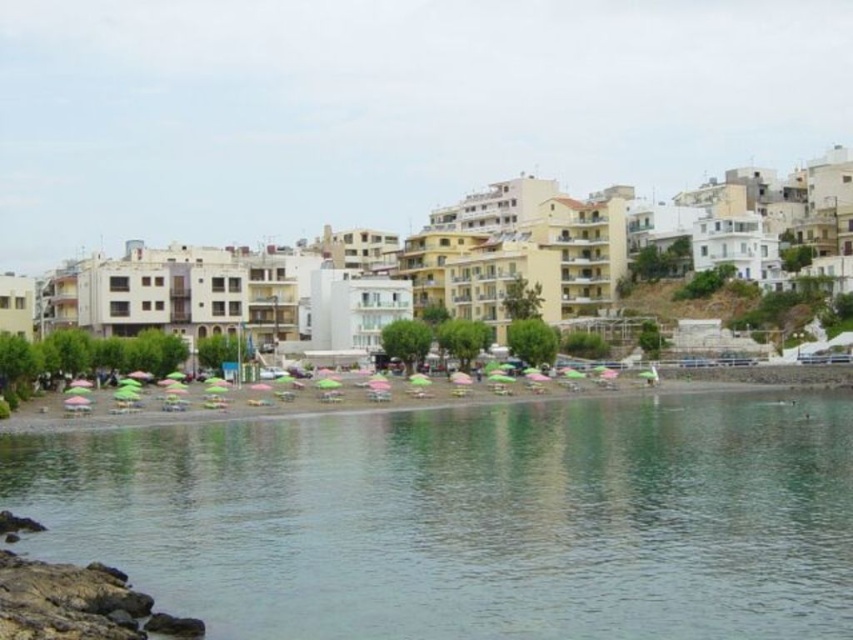
Question: Does clear water at lower center appear under beige stucco hotel at center?

Choices:
 (A) no
 (B) yes

Answer: (B)

Question: Which of the following is the farthest from the observer?

Choices:
 (A) clear water at lower center
 (B) beige stucco hotel at center
 (C) green umbrellas at lower center

Answer: (B)

Question: Which object appears closest to the camera in this image?

Choices:
 (A) beige stucco hotel at center
 (B) green umbrellas at lower center

Answer: (B)

Question: Where is clear water at lower center located in relation to green umbrellas at lower center in the image?

Choices:
 (A) above
 (B) below

Answer: (B)

Question: Which of the following is the farthest from the observer?

Choices:
 (A) (132, 422)
 (B) (498, 474)

Answer: (A)

Question: Is clear water at lower center closer to the viewer compared to beige stucco hotel at center?

Choices:
 (A) no
 (B) yes

Answer: (B)